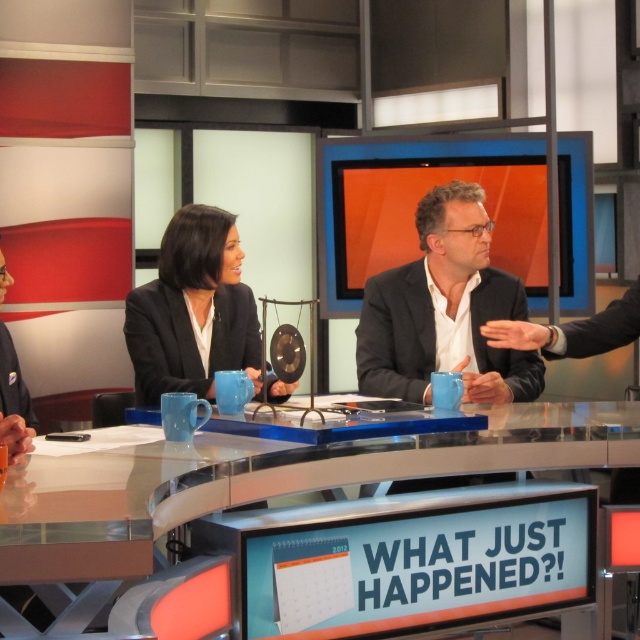
Can you confirm if clear glass table at center is smaller than dark gray fabric business suit at left?

No.

Between clear glass table at center and dark gray fabric business suit at left, which one appears on the left side from the viewer's perspective?

Positioned to the left is dark gray fabric business suit at left.

Does point (451, 435) lie in front of point (20, 403)?

Yes, it is in front of point (20, 403).

At what (x,y) coordinates should I click in order to perform the action: click on clear glass table at center. Please return your answer as a coordinate pair (x, y). Looking at the image, I should click on (262, 481).

Does dark gray suit at center have a greater width compared to dark gray fabric business suit at left?

Correct, the width of dark gray suit at center exceeds that of dark gray fabric business suit at left.

Is dark gray suit at center above dark gray fabric business suit at left?

Correct, dark gray suit at center is located above dark gray fabric business suit at left.

Image resolution: width=640 pixels, height=640 pixels. Describe the element at coordinates (396, 333) in the screenshot. I see `dark gray suit at center` at that location.

In order to click on dark gray suit at center in this screenshot , I will do [396, 333].

Based on the photo, can you confirm if clear glass table at center is bigger than black matte business suit at center?

Indeed, clear glass table at center has a larger size compared to black matte business suit at center.

Which is in front, point (568, 410) or point (157, 396)?

Point (568, 410) is in front.

The width and height of the screenshot is (640, 640). I want to click on clear glass table at center, so click(x=262, y=481).